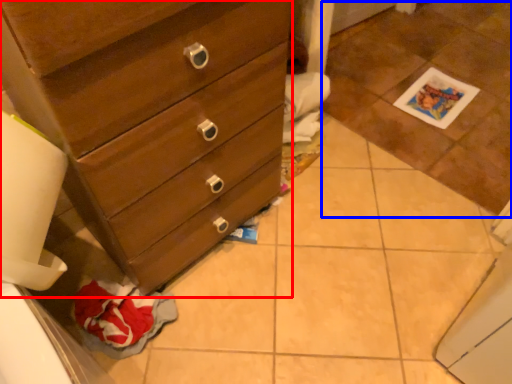
Question: Which object is closer to the camera taking this photo, chest of drawers (highlighted by a red box) or tile (highlighted by a blue box)?

Choices:
 (A) chest of drawers
 (B) tile

Answer: (A)